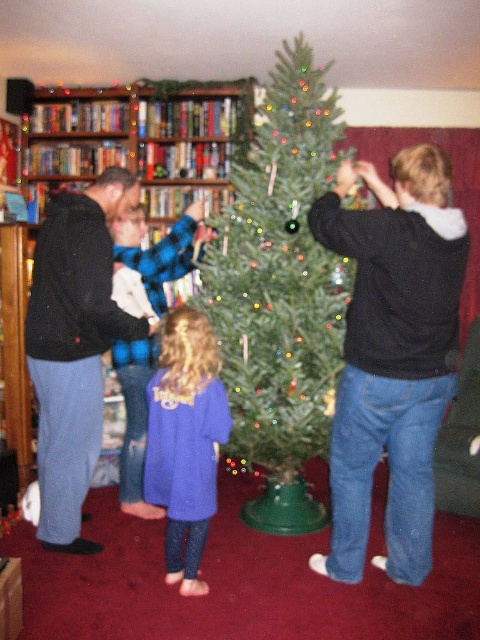
Question: Can you confirm if black hoodie at center is positioned to the left of matte black hoodie at center?

Choices:
 (A) yes
 (B) no

Answer: (B)

Question: Which point is closer to the camera?

Choices:
 (A) matte black hoodie at center
 (B) green matte christmas tree at center
 (C) black hoodie at center

Answer: (C)

Question: Which object is positioned closest to the green matte christmas tree at center?

Choices:
 (A) black hoodie at center
 (B) black hoodie at left

Answer: (A)

Question: Can you confirm if green matte christmas tree at center is positioned to the left of black hoodie at left?

Choices:
 (A) no
 (B) yes

Answer: (A)

Question: Does black hoodie at center have a greater width compared to wooden bookshelf at upper left?

Choices:
 (A) no
 (B) yes

Answer: (A)

Question: Which point appears farthest from the camera in this image?

Choices:
 (A) (182, 454)
 (B) (55, 113)
 (C) (275, 208)
 (D) (48, 440)

Answer: (B)